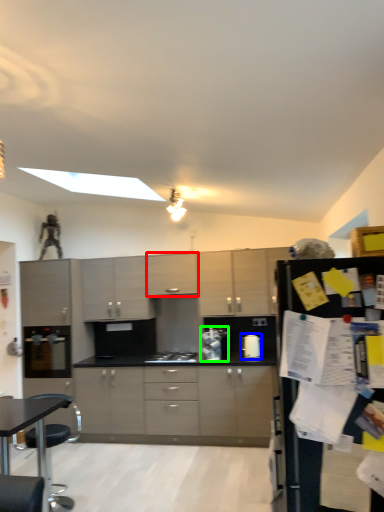
Question: Which object is positioned farthest from cabinetry (highlighted by a red box)? Select from kitchen appliance (highlighted by a blue box) and appliance (highlighted by a green box).

Choices:
 (A) kitchen appliance
 (B) appliance

Answer: (A)